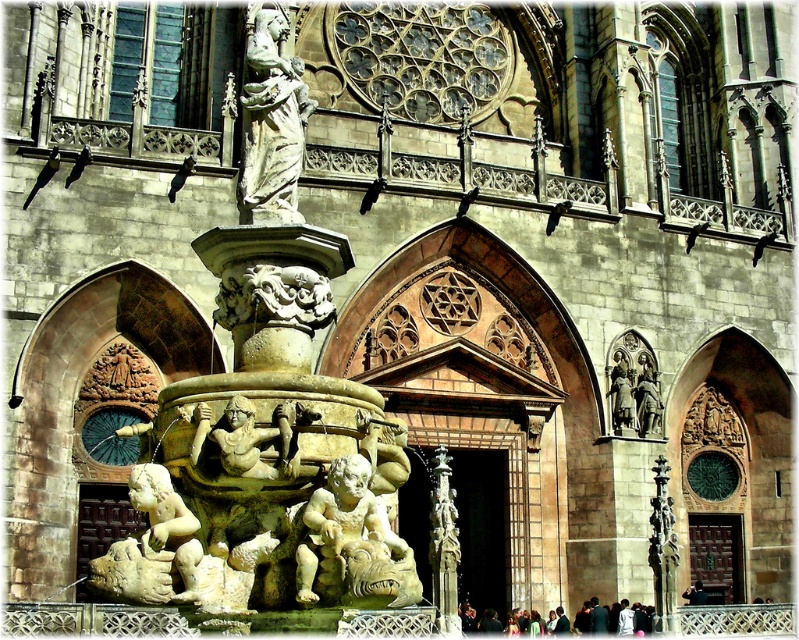
Question: Is carved stone gargoyle at center positioned in front of polished bronze statue at center?

Choices:
 (A) no
 (B) yes

Answer: (B)

Question: Which object is positioned farthest from the white marble cherub at lower left?

Choices:
 (A) white marble statue at upper center
 (B) polished bronze statue at right
 (C) polished bronze statue at center

Answer: (B)

Question: Does white stone fountain at center have a smaller size compared to white marble statue at upper center?

Choices:
 (A) no
 (B) yes

Answer: (A)

Question: Can you confirm if white stone fountain at center is thinner than polished bronze statue at right?

Choices:
 (A) no
 (B) yes

Answer: (A)

Question: Estimate the real-world distances between objects in this image. Which object is farther from the white marble cherub at lower left?

Choices:
 (A) polished bronze statue at center
 (B) white marble statue at upper center
 (C) carved stone gargoyle at center
 (D) polished bronze statue at right

Answer: (D)

Question: Among these points, which one is farthest from the camera?

Choices:
 (A) (614, 381)
 (B) (305, 556)

Answer: (A)